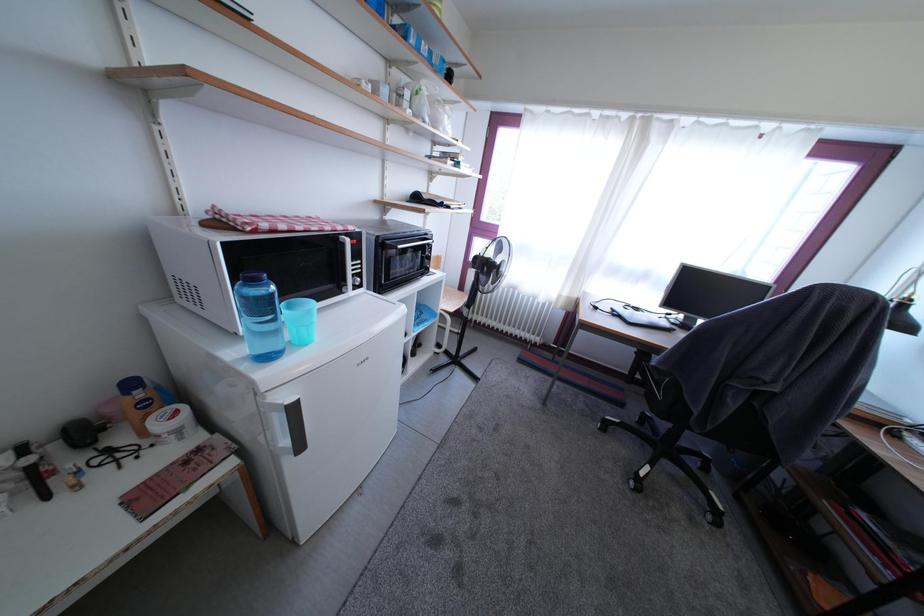
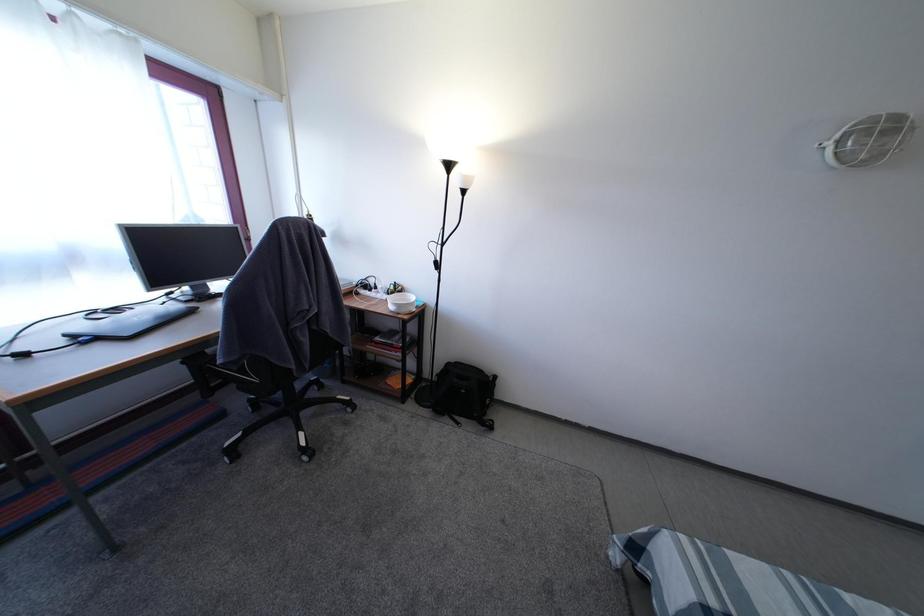
The images are taken continuously from a first-person perspective. In which direction is your viewpoint rotating?

The camera's rotation is toward right-down.